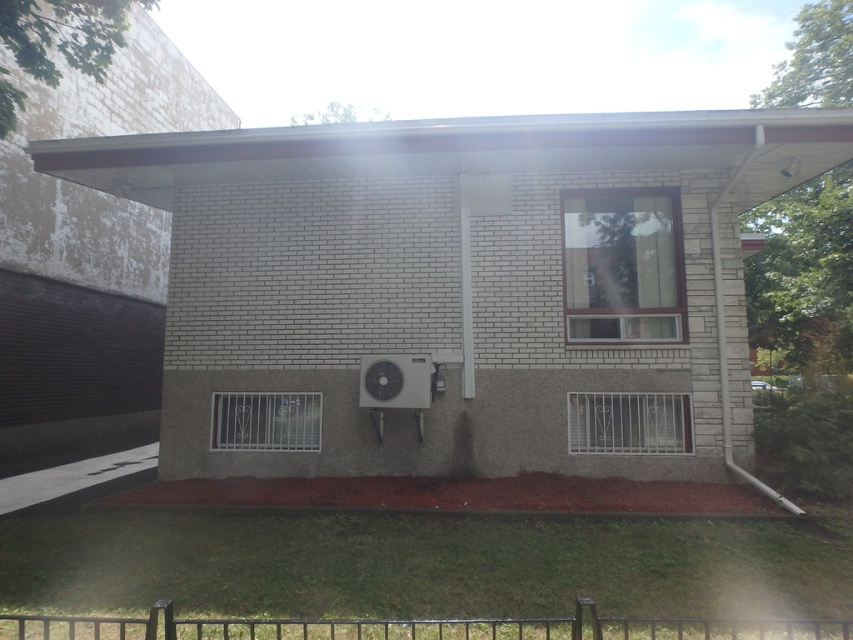
Question: Does clear glass window at center appear on the right side of metallic silver window at lower center?

Choices:
 (A) yes
 (B) no

Answer: (B)

Question: Does clear glass window at center have a smaller size compared to metallic silver window at lower center?

Choices:
 (A) no
 (B) yes

Answer: (A)

Question: Which point appears closest to the camera in this image?

Choices:
 (A) (643, 284)
 (B) (631, 403)
 (C) (277, 433)
 (D) (402, 388)

Answer: (D)

Question: Which object is farther from the camera taking this photo?

Choices:
 (A) silver metallic air conditioner at center
 (B) metallic silver window at lower left
 (C) clear glass window at center

Answer: (B)

Question: Can you confirm if metallic silver window at lower center is wider than metallic silver window at lower left?

Choices:
 (A) yes
 (B) no

Answer: (A)

Question: Based on their relative distances, which object is nearer to the metallic silver window at lower left?

Choices:
 (A) clear glass window at center
 (B) metallic silver window at lower center

Answer: (B)